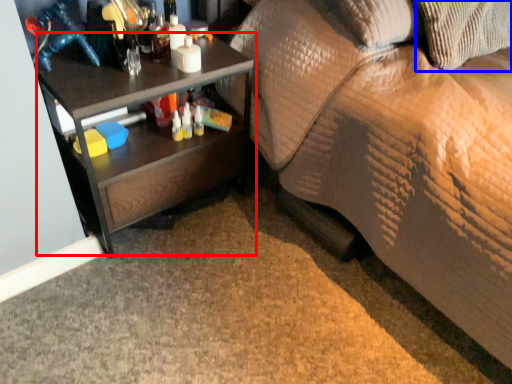
Question: Which of the following is the farthest to the observer, desk (highlighted by a red box) or pillow (highlighted by a blue box)?

Choices:
 (A) desk
 (B) pillow

Answer: (B)